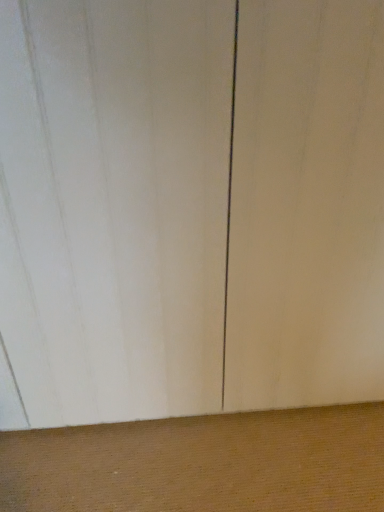
Image resolution: width=384 pixels, height=512 pixels. Describe the element at coordinates (202, 463) in the screenshot. I see `brown textured carpet at bottom` at that location.

Find the location of a particular element. Image resolution: width=384 pixels, height=512 pixels. brown textured carpet at bottom is located at coordinates (202, 463).

This screenshot has width=384, height=512. Identify the location of brown textured carpet at bottom. (202, 463).